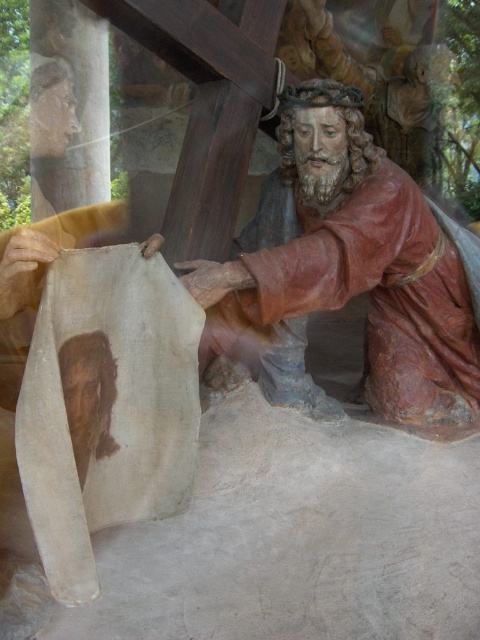
Question: Is wooden statue at center below smooth beige cloth at lower left?

Choices:
 (A) no
 (B) yes

Answer: (A)

Question: Which point is closer to the camera?

Choices:
 (A) (448, 305)
 (B) (84, 372)

Answer: (B)

Question: Does wooden statue at center have a lesser width compared to smooth beige cloth at lower left?

Choices:
 (A) no
 (B) yes

Answer: (A)

Question: Does wooden statue at center have a greater width compared to smooth beige cloth at lower left?

Choices:
 (A) no
 (B) yes

Answer: (B)